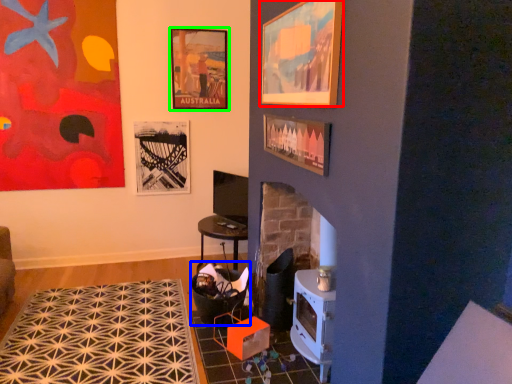
Question: Considering the real-world distances, which object is farthest from picture frame (highlighted by a red box)? rocking chair (highlighted by a blue box) or picture frame (highlighted by a green box)?

Choices:
 (A) rocking chair
 (B) picture frame

Answer: (B)